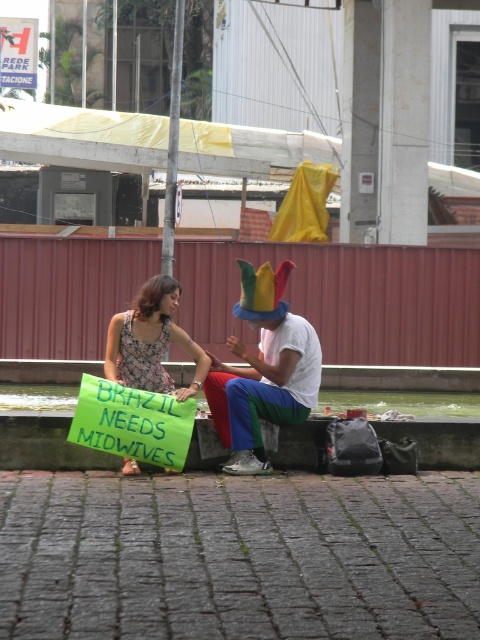
Is green concrete curb at lower center to the right of brick pavement at lower center from the viewer's perspective?

Incorrect, green concrete curb at lower center is not on the right side of brick pavement at lower center.

I want to click on green concrete curb at lower center, so click(46, 444).

What do you see at coordinates (46, 444) in the screenshot?
I see `green concrete curb at lower center` at bounding box center [46, 444].

Where is `green concrete curb at lower center`? The width and height of the screenshot is (480, 640). green concrete curb at lower center is located at coordinates (46, 444).

Between point (255, 284) and point (35, 365), which one is positioned behind?

The point (35, 365) is more distant.

Describe the element at coordinates (263, 371) in the screenshot. This screenshot has height=640, width=480. I see `multicolored fabric hat at center` at that location.

Locate an element on the screen. This screenshot has width=480, height=640. multicolored fabric hat at center is located at coordinates (263, 371).

Image resolution: width=480 pixels, height=640 pixels. I want to click on multicolored fabric hat at center, so click(x=263, y=371).

Does brick pavement at center have a lesser height compared to floral dress at center?

Yes.

Is brick pavement at center positioned at the back of floral dress at center?

That is False.

The image size is (480, 640). Find the location of `brick pavement at center`. brick pavement at center is located at coordinates (239, 556).